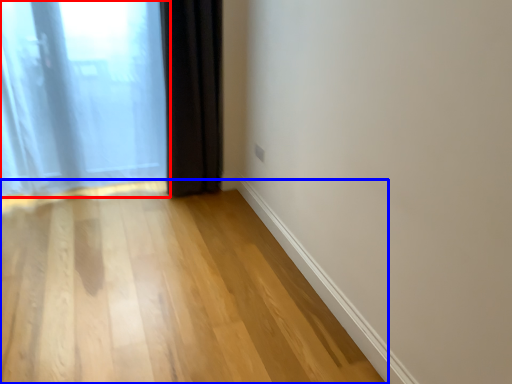
Question: Which of the following is the closest to the observer, curtain (highlighted by a red box) or corridor (highlighted by a blue box)?

Choices:
 (A) curtain
 (B) corridor

Answer: (B)